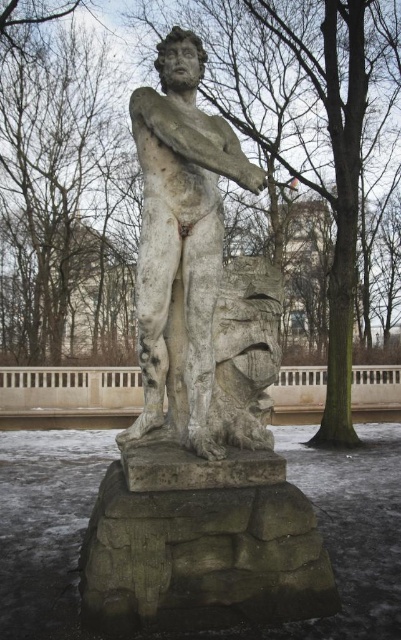
Question: Does bare branches at upper left appear over stone statue at center?

Choices:
 (A) yes
 (B) no

Answer: (A)

Question: Can you confirm if bare branches at upper left is thinner than stone statue at center?

Choices:
 (A) yes
 (B) no

Answer: (B)

Question: Which of the following is the closest to the observer?

Choices:
 (A) stone statue at center
 (B) bare branches at upper left

Answer: (A)

Question: Which object is closer to the camera taking this photo?

Choices:
 (A) bare branches at upper left
 (B) stone statue at center

Answer: (B)

Question: Is the position of bare branches at upper left less distant than that of stone statue at center?

Choices:
 (A) yes
 (B) no

Answer: (B)